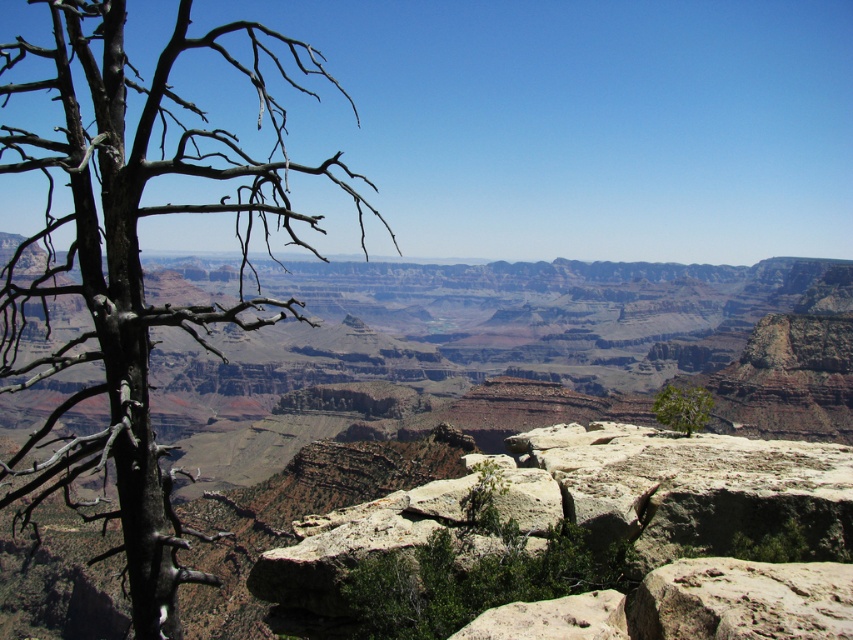
You are standing at the edge of the Grand Canyon and see two points marked in the image. The first point is at coordinates point (187,570) and the second is at point (711,403). Which point is closer to you?

Point (187,570) is closer to the viewer than point (711,403).